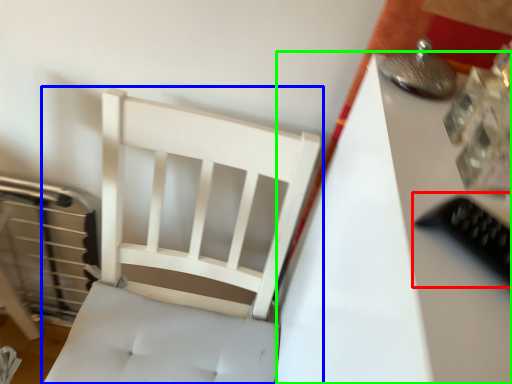
Question: Which object is the closest to the equipment (highlighted by a red box)? Choose among these: furniture (highlighted by a blue box) or table (highlighted by a green box).

Choices:
 (A) furniture
 (B) table

Answer: (B)